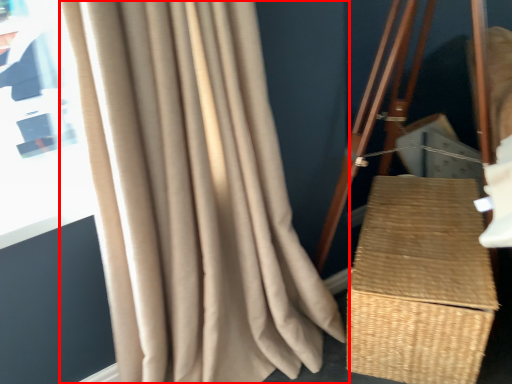
Question: Observing the image, what is the correct spatial positioning of curtain (annotated by the red box) in reference to basket?

Choices:
 (A) left
 (B) right

Answer: (A)